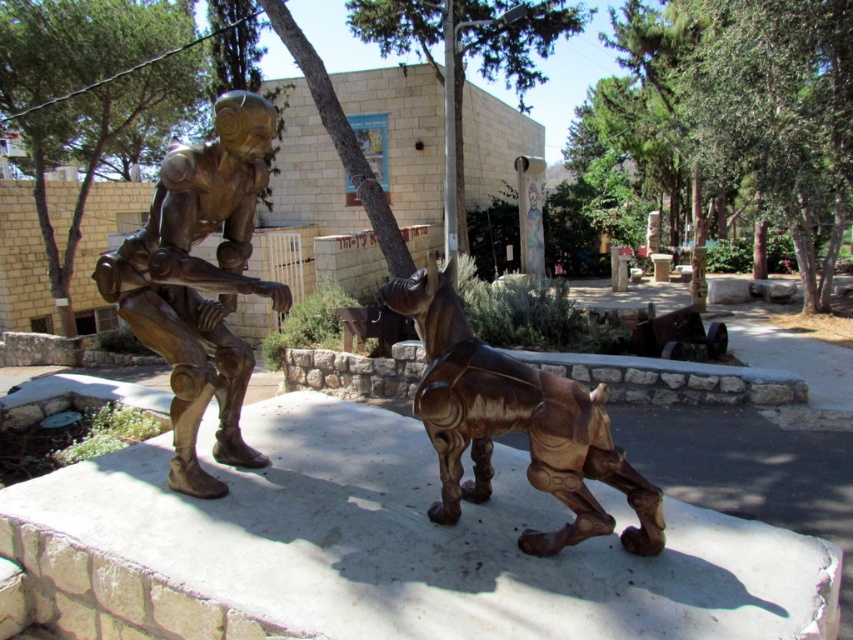
You are standing at the center of the park and want to find the bronze statue at left. According to the map, where should you look relative to your current position?

The bronze statue at left is located at coordinates 0.442 on the x axis and 0.234 on the y axis, so you should look towards the left and slightly forward from your current position at the center.